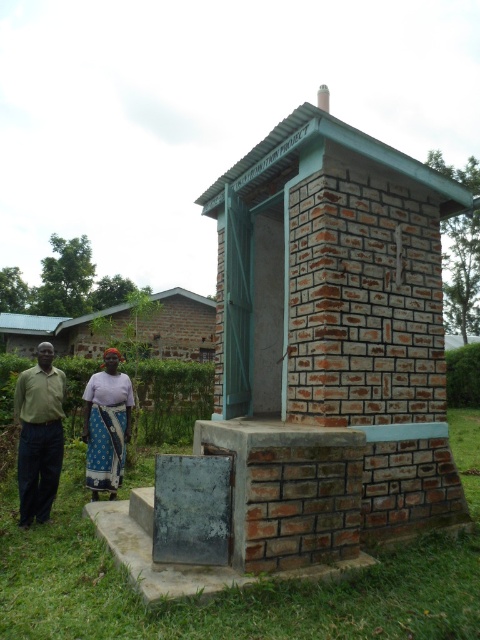
Does matte green shirt at left have a smaller size compared to blue printed fabric at lower left?

Yes.

Is point (22, 508) behind point (103, 390)?

That is False.

Identify the location of matte green shirt at left. [38, 435].

Does brick/rough brick toilet at center have a larger size compared to matte green shirt at left?

Actually, brick/rough brick toilet at center might be smaller than matte green shirt at left.

Can you confirm if brick/rough brick toilet at center is positioned to the right of matte green shirt at left?

Yes, brick/rough brick toilet at center is to the right of matte green shirt at left.

Which is in front, point (313, 426) or point (37, 396)?

Point (313, 426)

At what (x,y) coordinates should I click in order to perform the action: click on brick/rough brick toilet at center. Please return your answer as a coordinate pair (x, y). This screenshot has width=480, height=640. Looking at the image, I should click on (319, 358).

Does blue patterned skirt at lower left appear on the left side of blue printed fabric at lower left?

Yes, blue patterned skirt at lower left is to the left of blue printed fabric at lower left.

Does point (44, 472) come farther from viewer compared to point (108, 364)?

No, (44, 472) is in front of (108, 364).

At what (x,y) coordinates should I click in order to perform the action: click on blue patterned skirt at lower left. Please return your answer as a coordinate pair (x, y). Image resolution: width=480 pixels, height=640 pixels. Looking at the image, I should click on (38, 435).